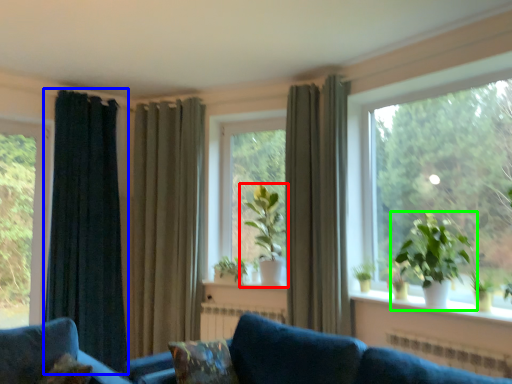
Question: Estimate the real-world distances between objects in this image. Which object is farther from houseplant (highlighted by a red box), curtain (highlighted by a blue box) or houseplant (highlighted by a green box)?

Choices:
 (A) curtain
 (B) houseplant

Answer: (A)